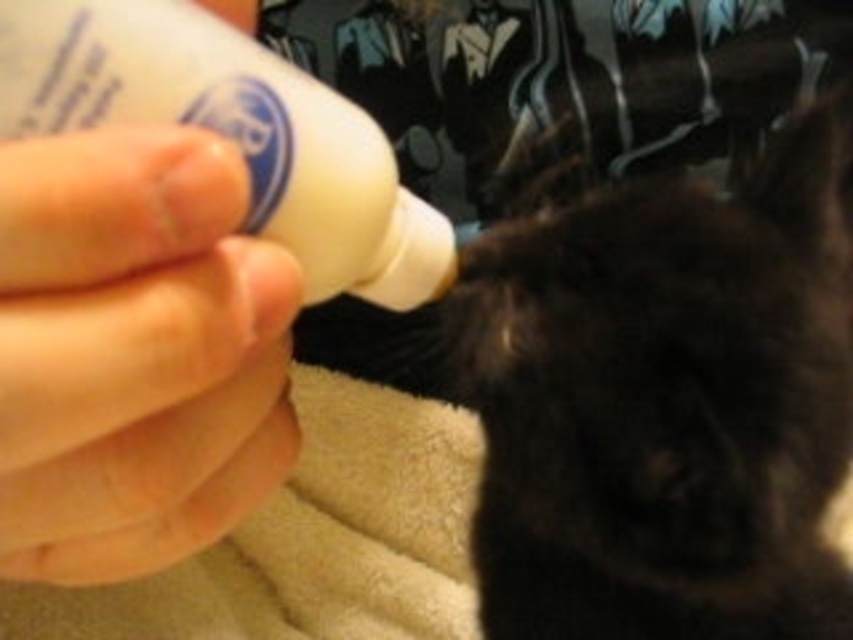
Which is below, black fur cat at center or white plastic bottle at upper left?

Positioned lower is black fur cat at center.

Is black fur cat at center closer to camera compared to white plastic bottle at upper left?

That is False.

Where is `black fur cat at center`? The height and width of the screenshot is (640, 853). black fur cat at center is located at coordinates (665, 401).

What are the coordinates of `black fur cat at center` in the screenshot? It's located at [665, 401].